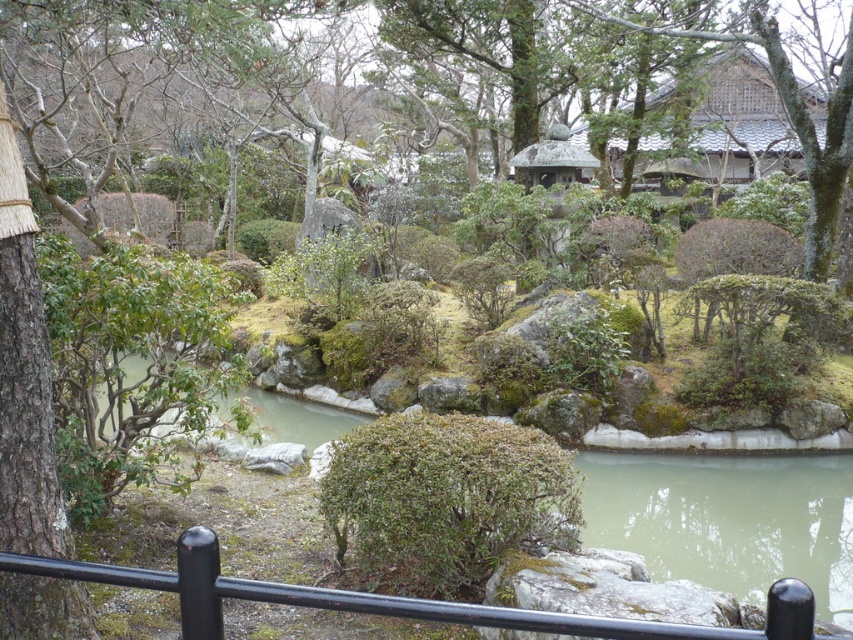
Question: Which object is positioned farthest from the smooth stone gazebo at center?

Choices:
 (A) gray tiled roof at upper right
 (B) black metal fence at lower center
 (C) green leafy bush at center

Answer: (A)

Question: Which point is closer to the camera?

Choices:
 (A) (767, 109)
 (B) (590, 168)

Answer: (B)

Question: Which point appears closest to the camera in this image?

Choices:
 (A) (815, 120)
 (B) (582, 166)

Answer: (B)

Question: In this image, where is black metal fence at lower center located relative to gray tiled roof at upper right?

Choices:
 (A) above
 (B) below

Answer: (B)

Question: Does gray tiled roof at upper right have a smaller size compared to smooth stone gazebo at center?

Choices:
 (A) yes
 (B) no

Answer: (B)

Question: Where is black metal fence at lower center located in relation to gray tiled roof at upper right in the image?

Choices:
 (A) above
 (B) below

Answer: (B)